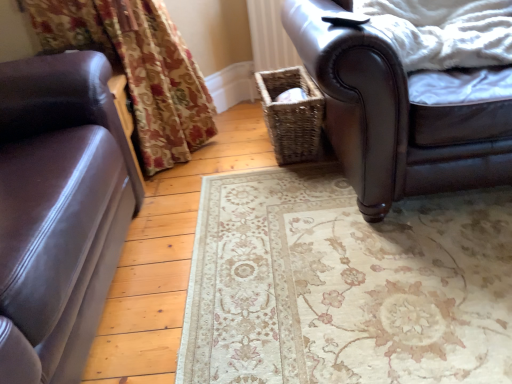
Measure the distance between woven brown basket at center and camera.

The depth of woven brown basket at center is 1.67 meters.

This screenshot has width=512, height=384. What are the coordinates of `woven brown basket at center` in the screenshot? It's located at (291, 115).

Which object is closer to the camera, brown leather chair at upper right or white fluffy blanket at upper right?

Positioned in front is brown leather chair at upper right.

Which is more to the left, brown leather chair at upper right or white fluffy blanket at upper right?

Positioned to the left is brown leather chair at upper right.

From the image's perspective, is brown leather chair at upper right positioned above or below white fluffy blanket at upper right?

Clearly, from the image's perspective, brown leather chair at upper right is below white fluffy blanket at upper right.

Is matte brown leather couch at left facing away from brown leather chair at upper right?

No, matte brown leather couch at left is not facing the opposite direction of brown leather chair at upper right.

In terms of height, does matte brown leather couch at left look taller or shorter compared to brown leather chair at upper right?

In the image, matte brown leather couch at left appears to be taller than brown leather chair at upper right.

From a real-world perspective, between matte brown leather couch at left and brown leather chair at upper right, who is vertically lower?

brown leather chair at upper right.

Between matte brown leather couch at left and woven brown basket at center, which one has larger size?

With larger size is matte brown leather couch at left.

Based on the photo, who is taller, matte brown leather couch at left or woven brown basket at center?

matte brown leather couch at left.

Is matte brown leather couch at left to the right of woven brown basket at center from the viewer's perspective?

No, matte brown leather couch at left is not to the right of woven brown basket at center.

Which of these two, white fluffy blanket at upper right or woven brown basket at center, is wider?

With larger width is white fluffy blanket at upper right.

Which is nearer, (503, 21) or (263, 76)?

The point (503, 21) is closer.

Is white fluffy blanket at upper right facing towards woven brown basket at center?

No, white fluffy blanket at upper right is not oriented towards woven brown basket at center.

From the picture: Does white fluffy blanket at upper right have a larger size compared to woven brown basket at center?

Indeed, white fluffy blanket at upper right has a larger size compared to woven brown basket at center.

Could you tell me if woven brown basket at center is facing matte brown leather couch at left?

No, woven brown basket at center is not facing towards matte brown leather couch at left.

Is woven brown basket at center positioned in front of matte brown leather couch at left?

No, woven brown basket at center is behind matte brown leather couch at left.

Consider the image. Is woven brown basket at center next to matte brown leather couch at left?

There is a gap between woven brown basket at center and matte brown leather couch at left.

Looking at this image, is woven brown basket at center wider or thinner than matte brown leather couch at left?

In the image, woven brown basket at center appears to be wider than matte brown leather couch at left.

Is matte brown leather couch at left in contact with white fluffy blanket at upper right?

No, matte brown leather couch at left is not in contact with white fluffy blanket at upper right.

From the image's perspective, is matte brown leather couch at left located above or below white fluffy blanket at upper right?

Based on their image positions, matte brown leather couch at left is located beneath white fluffy blanket at upper right.

Is matte brown leather couch at left positioned in front of white fluffy blanket at upper right?

Yes.

From a real-world perspective, relative to white fluffy blanket at upper right, is matte brown leather couch at left vertically above or below?

In terms of real-world spatial position, matte brown leather couch at left is below white fluffy blanket at upper right.

Which object is wider, white fluffy blanket at upper right or brown leather chair at upper right?

With larger width is brown leather chair at upper right.

From the picture: Can we say white fluffy blanket at upper right lies outside brown leather chair at upper right?

No.

Where is `blanket on the right of the brown leather chair at upper right`? This screenshot has width=512, height=384. blanket on the right of the brown leather chair at upper right is located at coordinates (444, 31).

Who is more distant, white fluffy blanket at upper right or brown leather chair at upper right?

white fluffy blanket at upper right is further away from the camera.

The image size is (512, 384). What are the coordinates of `chair on the left of white fluffy blanket at upper right` in the screenshot? It's located at (393, 116).

At what (x,y) coordinates should I click in order to perform the action: click on studio couch that appears in front of the brown leather chair at upper right. Please return your answer as a coordinate pair (x, y). Looking at the image, I should click on (59, 211).

Estimate the real-world distances between objects in this image. Which object is closer to matte brown leather couch at left, brown leather chair at upper right or white fluffy blanket at upper right?

Based on the image, brown leather chair at upper right appears to be nearer to matte brown leather couch at left.

Which object lies nearer to the anchor point brown leather chair at upper right, matte brown leather couch at left or white fluffy blanket at upper right?

Among the two, white fluffy blanket at upper right is located nearer to brown leather chair at upper right.

From the picture: Estimate the real-world distances between objects in this image. Which object is closer to matte brown leather couch at left, woven brown basket at center or white fluffy blanket at upper right?

woven brown basket at center is closer to matte brown leather couch at left.

Based on their spatial positions, is brown leather chair at upper right or matte brown leather couch at left closer to woven brown basket at center?

Among the two, brown leather chair at upper right is located nearer to woven brown basket at center.

When comparing their distances from white fluffy blanket at upper right, does matte brown leather couch at left or woven brown basket at center seem further?

matte brown leather couch at left is positioned further to the anchor white fluffy blanket at upper right.

Looking at the image, which one is located further to white fluffy blanket at upper right, matte brown leather couch at left or brown leather chair at upper right?

The object further to white fluffy blanket at upper right is matte brown leather couch at left.

Based on their spatial positions, is woven brown basket at center or brown leather chair at upper right further from white fluffy blanket at upper right?

The object further to white fluffy blanket at upper right is woven brown basket at center.

From the image, which object appears to be farther from white fluffy blanket at upper right, brown leather chair at upper right or matte brown leather couch at left?

matte brown leather couch at left is positioned further to the anchor white fluffy blanket at upper right.

Identify the location of chair between matte brown leather couch at left and white fluffy blanket at upper right from left to right. This screenshot has height=384, width=512. (393, 116).

Find the location of a particular element. The width and height of the screenshot is (512, 384). basket situated between matte brown leather couch at left and white fluffy blanket at upper right from left to right is located at coordinates (291, 115).

Find the location of `basket between matte brown leather couch at left and brown leather chair at upper right from left to right`. basket between matte brown leather couch at left and brown leather chair at upper right from left to right is located at coordinates (291, 115).

The height and width of the screenshot is (384, 512). What are the coordinates of `blanket between brown leather chair at upper right and woven brown basket at center in the front-back direction` in the screenshot? It's located at (444, 31).